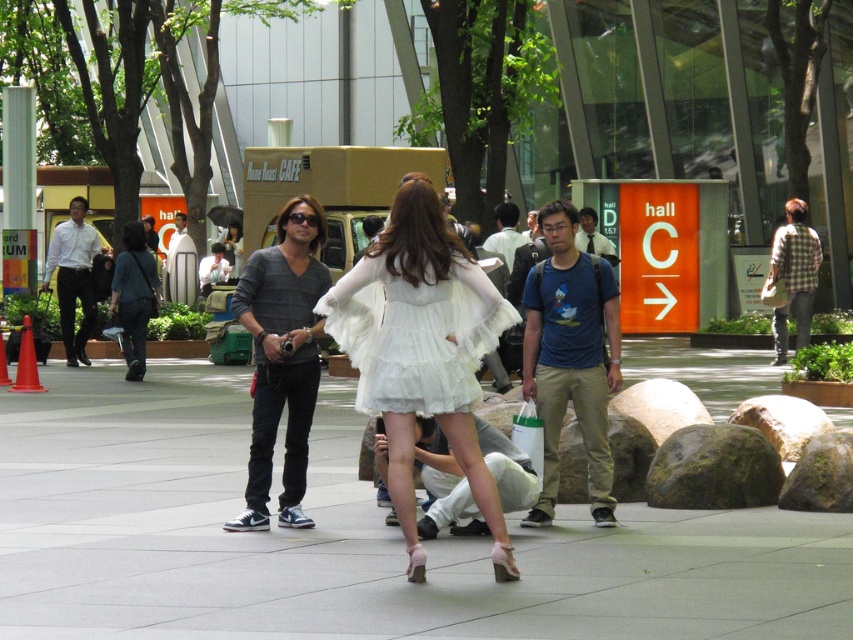
You are a photographer trying to capture a candid shot of two people in the scene. You see a white shirt at left and a plaid shirt at right. Which person is positioned more to the left side?

The white shirt at left is positioned more to the left side than the plaid shirt at right.

You are a photographer trying to capture a candid shot of two people in the scene. The subjects are the white shirt at left and the plaid shirt at right. Based on their positions, which subject is positioned lower in the frame?

The white shirt at left is positioned lower in the frame since it is below the plaid shirt at right.

You are a photographer trying to capture a candid shot of the white lace dress at center and the gray sweater at center. Since you want to focus on both subjects equally, which subject should you zoom in on more to ensure they appear the same size in your photo?

The white lace dress at center occupies less space than gray sweater at center, so you should zoom in more on the white lace dress at center to make it appear larger and balance its size with the gray sweater at center in the photo.